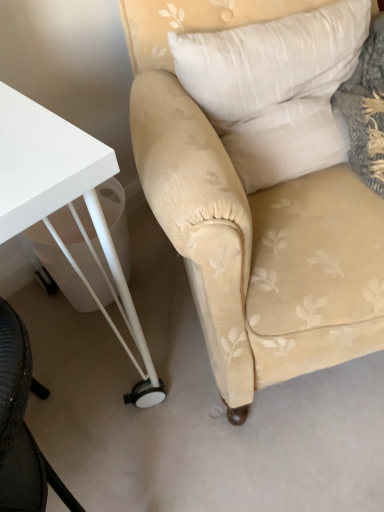
Question: From the image's perspective, is beige fabric chair at center beneath white soft pillow at upper right?

Choices:
 (A) no
 (B) yes

Answer: (B)

Question: Is beige fabric chair at center at the left side of white soft pillow at upper right?

Choices:
 (A) no
 (B) yes

Answer: (A)

Question: Can you confirm if beige fabric chair at center is smaller than white soft pillow at upper right?

Choices:
 (A) yes
 (B) no

Answer: (B)

Question: From a real-world perspective, is beige fabric chair at center located beneath white soft pillow at upper right?

Choices:
 (A) no
 (B) yes

Answer: (B)

Question: Is beige fabric chair at center not inside white soft pillow at upper right?

Choices:
 (A) no
 (B) yes

Answer: (B)

Question: Is beige fabric chair at center further to the viewer compared to white soft pillow at upper right?

Choices:
 (A) yes
 (B) no

Answer: (B)

Question: Does white soft pillow at upper right lie in front of white glossy table at lower left?

Choices:
 (A) no
 (B) yes

Answer: (A)

Question: Does white soft pillow at upper right come behind white glossy table at lower left?

Choices:
 (A) no
 (B) yes

Answer: (B)

Question: Would you say white soft pillow at upper right is a long distance from white glossy table at lower left?

Choices:
 (A) yes
 (B) no

Answer: (B)

Question: Does white soft pillow at upper right have a smaller size compared to white glossy table at lower left?

Choices:
 (A) yes
 (B) no

Answer: (A)

Question: Is white soft pillow at upper right bigger than white glossy table at lower left?

Choices:
 (A) no
 (B) yes

Answer: (A)

Question: Is white soft pillow at upper right at the right side of white glossy table at lower left?

Choices:
 (A) yes
 (B) no

Answer: (A)

Question: Would you consider beige fabric chair at center to be distant from white glossy table at lower left?

Choices:
 (A) yes
 (B) no

Answer: (B)